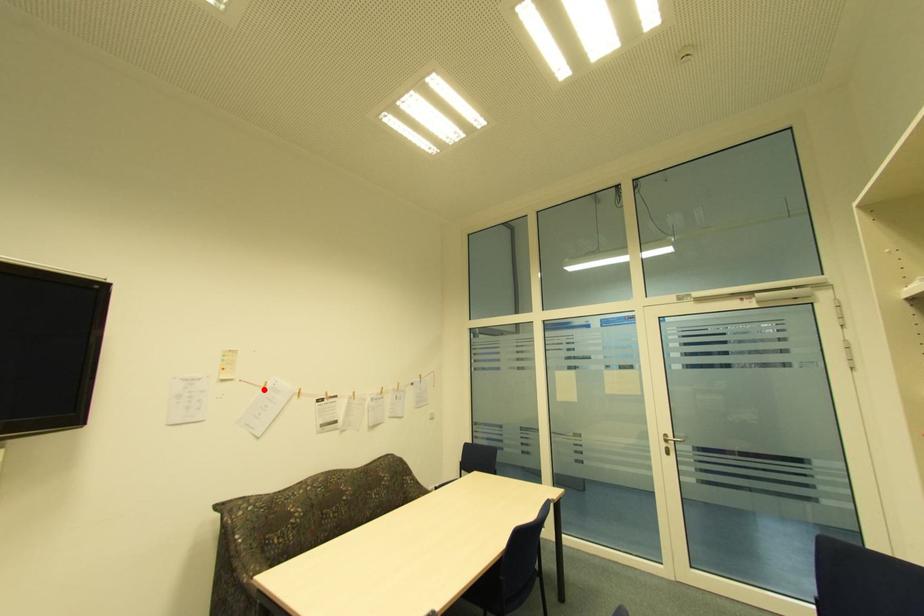
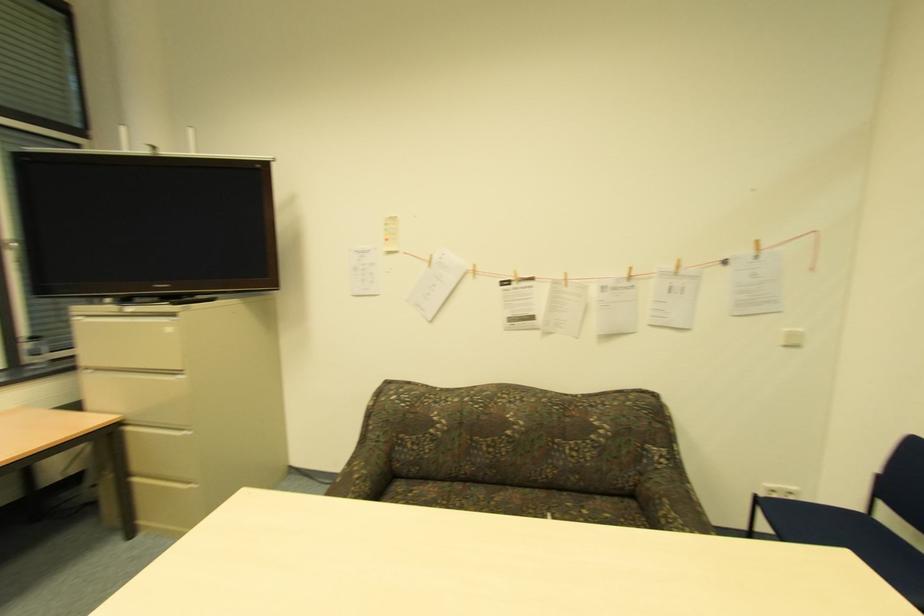
Where in the second image is the point corresponding to the highlighted location from the first image?

(428, 265)